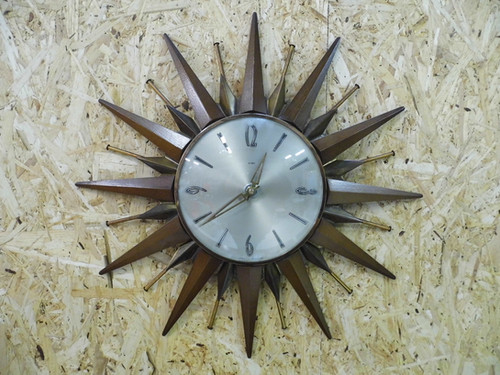
Find the location of a particular element. The height and width of the screenshot is (375, 500). silver clock face is located at coordinates (244, 214).